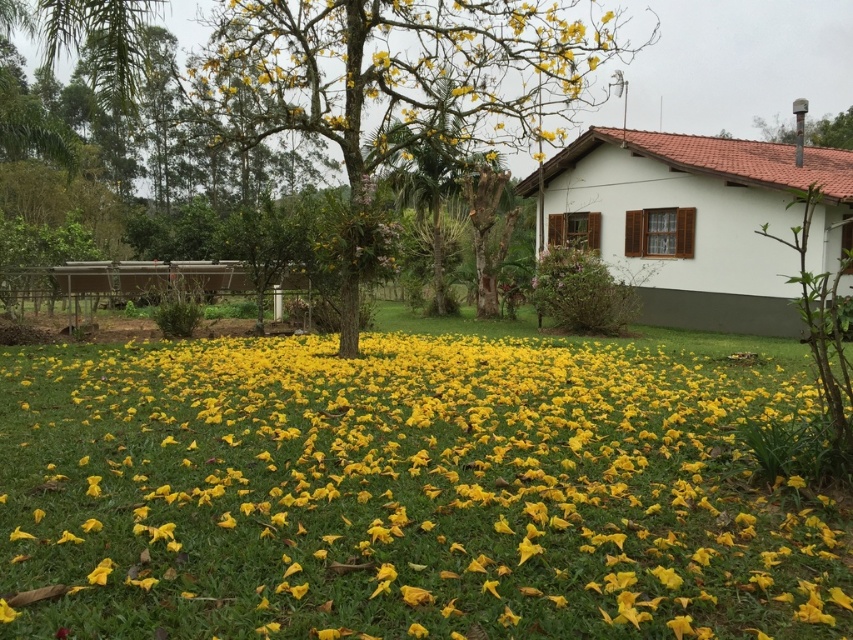
Question: Can you confirm if yellow matte flower at center is bigger than yellow leafy tree at center?

Choices:
 (A) no
 (B) yes

Answer: (A)

Question: Which of the following is the closest to the observer?

Choices:
 (A) yellow leafy tree at center
 (B) yellow matte flower at center
 (C) smooth gray chimney at upper right

Answer: (B)

Question: Which of the following is the closest to the observer?

Choices:
 (A) (160, 545)
 (B) (415, 124)
 (C) (845, 134)

Answer: (A)

Question: Which point is closer to the camera?

Choices:
 (A) smooth gray chimney at upper right
 (B) yellow leafy tree at center
 (C) yellow matte flower at center

Answer: (C)

Question: Is yellow matte flower at center below smooth gray chimney at upper right?

Choices:
 (A) yes
 (B) no

Answer: (A)

Question: Is yellow matte flower at center in front of smooth gray chimney at upper right?

Choices:
 (A) no
 (B) yes

Answer: (B)